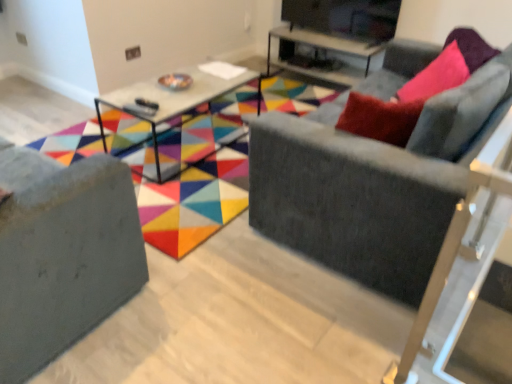
Question: Does matte black tv stand at upper center have a larger size compared to matte gray sofa at center?

Choices:
 (A) yes
 (B) no

Answer: (B)

Question: From the image's perspective, is matte black tv stand at upper center on matte gray sofa at center?

Choices:
 (A) no
 (B) yes

Answer: (B)

Question: Is matte black tv stand at upper center oriented towards matte gray sofa at center?

Choices:
 (A) no
 (B) yes

Answer: (A)

Question: Considering the relative positions of matte black tv stand at upper center and matte gray sofa at center in the image provided, is matte black tv stand at upper center behind matte gray sofa at center?

Choices:
 (A) no
 (B) yes

Answer: (B)

Question: From a real-world perspective, is matte black tv stand at upper center physically below matte gray sofa at center?

Choices:
 (A) no
 (B) yes

Answer: (A)

Question: Considering the positions of point (282, 3) and point (203, 210), is point (282, 3) closer or farther from the camera than point (203, 210)?

Choices:
 (A) closer
 (B) farther

Answer: (B)

Question: In terms of size, does matte black tv stand at upper center appear bigger or smaller than matte gray sofa at center?

Choices:
 (A) big
 (B) small

Answer: (B)

Question: Is matte black tv stand at upper center in front of or behind matte gray sofa at center in the image?

Choices:
 (A) front
 (B) behind

Answer: (B)

Question: Considering the positions of matte black tv stand at upper center and matte gray sofa at center in the image, is matte black tv stand at upper center wider or thinner than matte gray sofa at center?

Choices:
 (A) wide
 (B) thin

Answer: (B)

Question: In the image, is matte gray sofa at center on the left side or the right side of velvet gray couch at right, marked as the first studio couch in a right-to-left arrangement?

Choices:
 (A) left
 (B) right

Answer: (A)

Question: Considering the positions of matte gray sofa at center and velvet gray couch at right, the 2th studio couch when ordered from left to right, in the image, is matte gray sofa at center wider or thinner than velvet gray couch at right, the 2th studio couch when ordered from left to right,?

Choices:
 (A) thin
 (B) wide

Answer: (B)

Question: Relative to velvet gray couch at right, marked as the first studio couch in a right-to-left arrangement, is matte gray sofa at center in front or behind?

Choices:
 (A) behind
 (B) front

Answer: (A)

Question: Considering the positions of matte gray sofa at center and velvet gray couch at right, the 2th studio couch when ordered from left to right, in the image, is matte gray sofa at center bigger or smaller than velvet gray couch at right, the 2th studio couch when ordered from left to right,?

Choices:
 (A) small
 (B) big

Answer: (A)

Question: From the image's perspective, is velvet gray couch at right, marked as the first studio couch in a right-to-left arrangement, above or below matte glass table at center, which appears as the 2th table when viewed from the back?

Choices:
 (A) below
 (B) above

Answer: (A)

Question: Looking at the image, does velvet gray couch at right, the 2th studio couch when ordered from left to right, seem bigger or smaller compared to matte glass table at center, which appears as the 2th table when viewed from the back?

Choices:
 (A) big
 (B) small

Answer: (A)